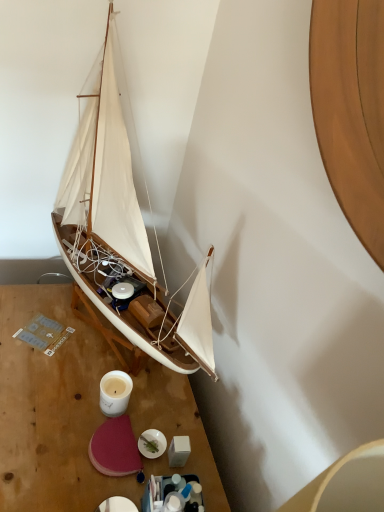
Locate an element on the screen. The width and height of the screenshot is (384, 512). free spot above wooden table at lower left (from a real-world perspective) is located at coordinates (x=77, y=385).